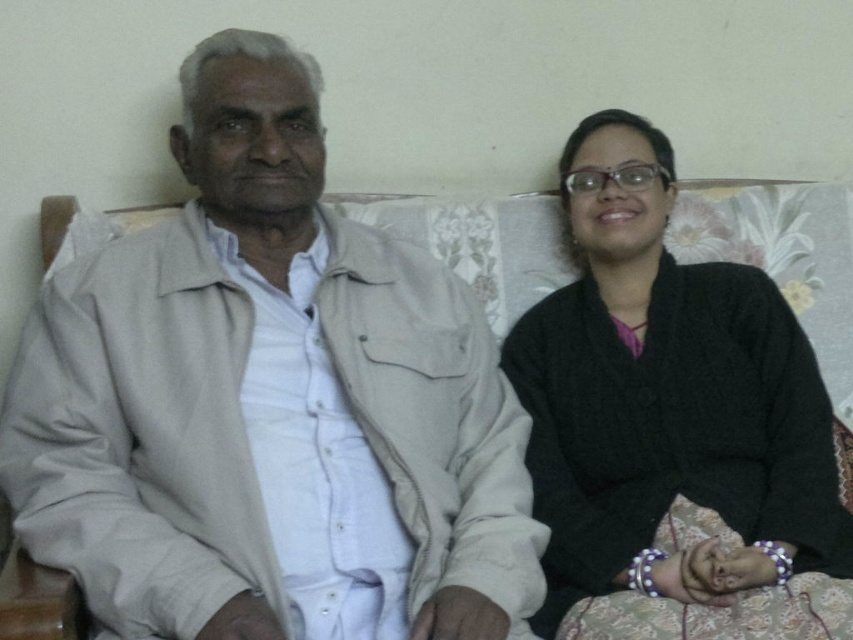
Consider the image. You are designing a new coat rack and need to hang both the light beige jacket at left and the black knitted sweater at right. If the coat rack has two hooks spaced 1 meter apart, will both items fit without overlapping?

The light beige jacket at left is wider than the black knitted sweater at right. Since the coat rack has two hooks spaced 1 meter apart, the total width required would depend on each item. However, since the jacket is wider, if its width is less than 0.5 meters, they could fit side by side. But without exact measurements, we can only confirm that the jacket is wider than the sweater.

You are a photographer standing at a distance of 40 inches from the sofa. You want to take a photo of the light beige jacket at left without including the person on the right. Is the jacket within your camera frame?

The light beige jacket at left is 38.25 inches away from the viewer, which is within the 40 inches distance. Therefore, the jacket is within the camera frame and can be captured without including the person on the right.

You are a tailor who needs to determine which garment requires more fabric to alter. You observe the light beige jacket at left and the black knitted sweater at right. Which one would need more fabric for alterations?

The light beige jacket at left requires more fabric for alterations since it is bigger than the black knitted sweater at right.